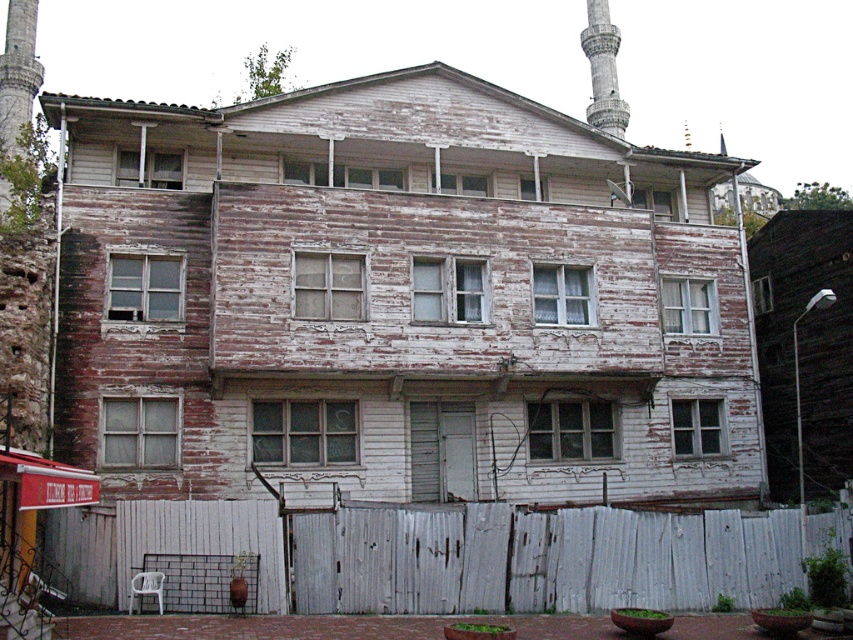
Consider the image. Measure the distance between white wooden fence at lower center and camera.

white wooden fence at lower center is 83.19 feet from camera.

Is white wooden fence at lower center wider than gray stone minaret at upper right?

Indeed, white wooden fence at lower center has a greater width compared to gray stone minaret at upper right.

You are a GUI agent. You are given a task and a screenshot of the screen. Output one action in this format:
    pyautogui.click(x=<x>, y=<y>)
    Task: Click on the white wooden fence at lower center
    This screenshot has width=853, height=640.
    Given the screenshot: What is the action you would take?
    pyautogui.click(x=538, y=557)